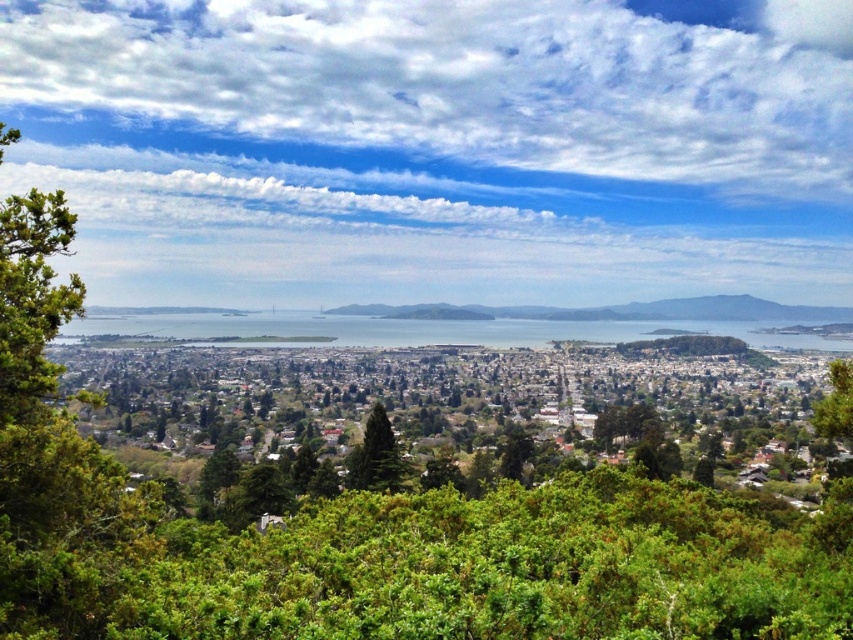
You are standing on a cliff overlooking the coastal city. You see the green grassy hill at center and the green matte tree at center in your view. Which one would you need to walk towards first if you want to reach both starting from the cliff?

The green grassy hill at center is closer to the viewer than the green matte tree at center, so you would reach the green grassy hill at center first before the green matte tree at center.

You are standing at the vantage point overlooking the coastal cityscape. You notice two trees in the center of the scene. Which tree is positioned to the left when looking at the green matte tree at center and the green leafy tree at center?

The green matte tree at center is positioned to the left of the green leafy tree at center.